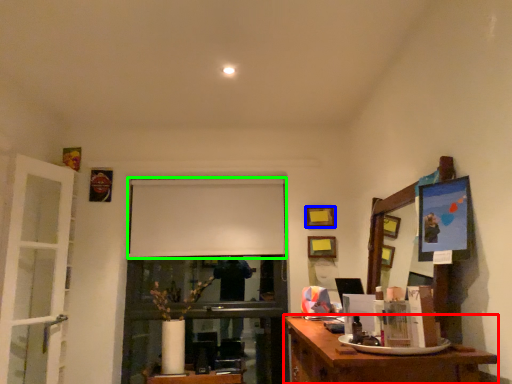
Question: Estimate the real-world distances between objects in this image. Which object is farther from desk (highlighted by a red box), picture frame (highlighted by a blue box) or projection screen (highlighted by a green box)?

Choices:
 (A) picture frame
 (B) projection screen

Answer: (A)